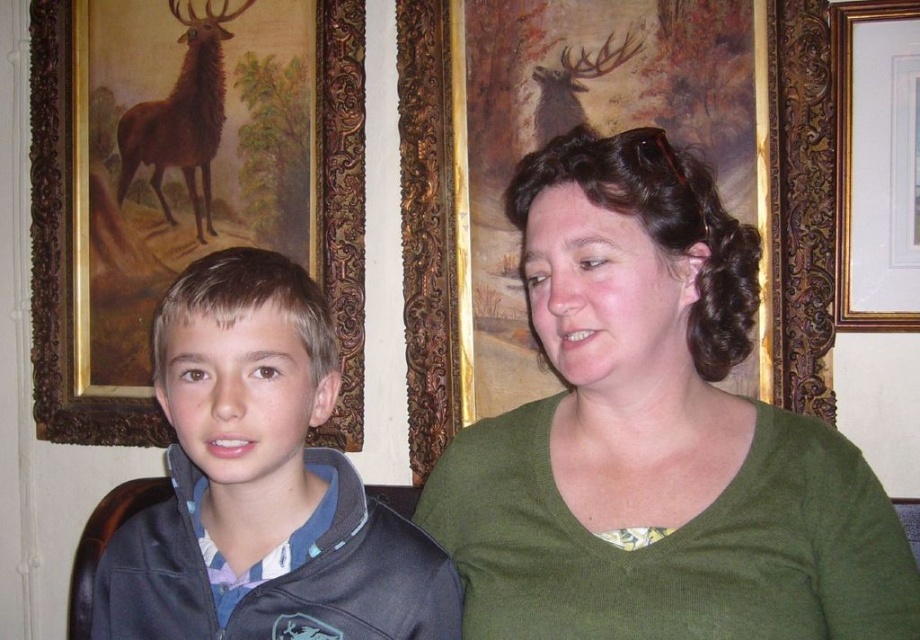
Question: Is green matte shirt at center positioned behind blue plaid shirt at left?

Choices:
 (A) yes
 (B) no

Answer: (B)

Question: In this image, where is gold ornate frame at upper center located relative to blue plaid shirt at left?

Choices:
 (A) above
 (B) below

Answer: (A)

Question: Which is nearer to the gold ornate frame at upper center?

Choices:
 (A) green matte shirt at center
 (B) gold ornate frame at upper right
 (C) blue plaid shirt at left

Answer: (B)

Question: Which of the following is the farthest from the observer?

Choices:
 (A) blue plaid shirt at left
 (B) gold ornate frame at upper center

Answer: (B)

Question: Which point is closer to the camera?

Choices:
 (A) (699, 225)
 (B) (489, 384)
 (C) (295, 182)

Answer: (A)

Question: Is gold ornate frame at upper left to the left of blue plaid shirt at left from the viewer's perspective?

Choices:
 (A) no
 (B) yes

Answer: (B)